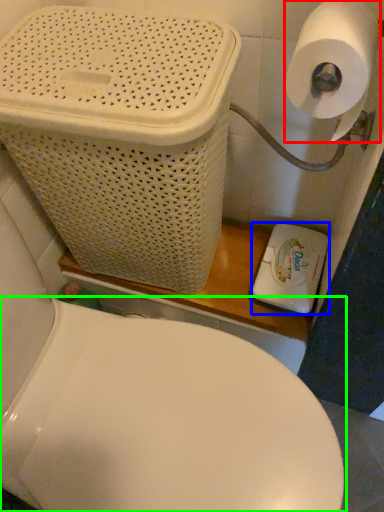
Question: Based on their relative distances, which object is nearer to toilet paper (highlighted by a red box)? Choose from appliance (highlighted by a blue box) and toilet (highlighted by a green box).

Choices:
 (A) appliance
 (B) toilet

Answer: (A)